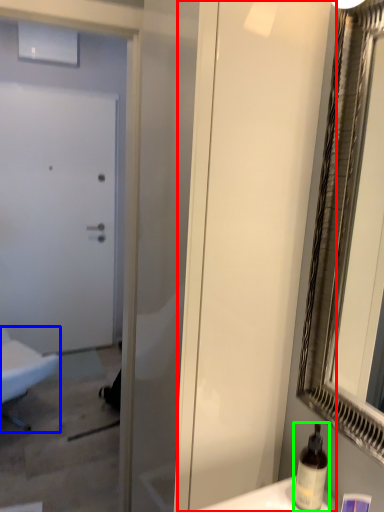
Question: Considering the real-world distances, which object is closest to screen door (highlighted by a red box)? furniture (highlighted by a blue box) or bottle (highlighted by a green box).

Choices:
 (A) furniture
 (B) bottle

Answer: (B)